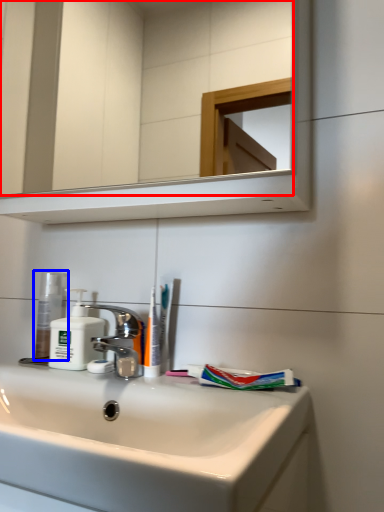
Question: Which object appears farthest to the camera in this image, mirror (highlighted by a red box) or toiletry (highlighted by a blue box)?

Choices:
 (A) mirror
 (B) toiletry

Answer: (B)